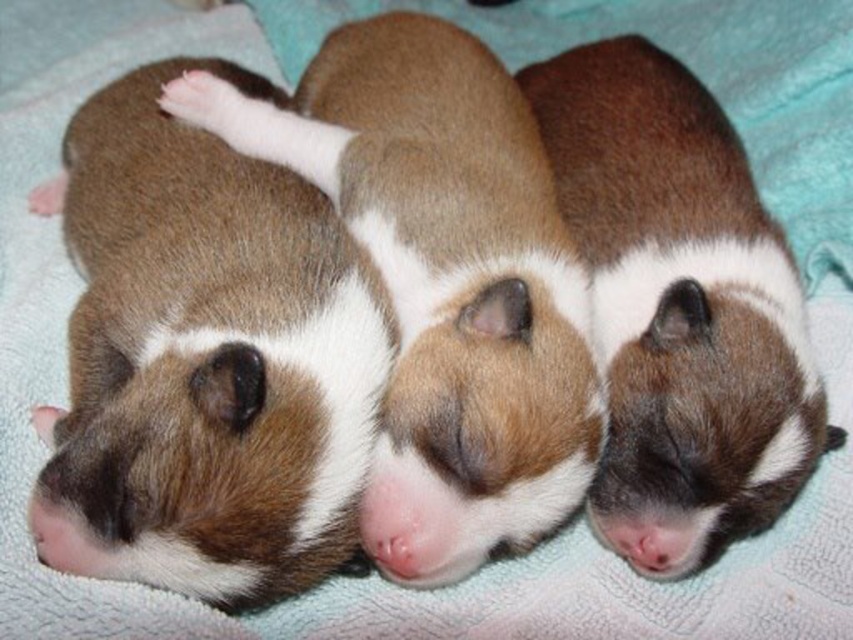
You are a pet owner who wants to place a divider between the brown fur puppy at left and the brown fuzzy guinea pig at center. If the divider is 10 cm wide, will it fit between them?

The brown fur puppy at left is wider than the brown fuzzy guinea pig at center. Therefore, a 10 cm wide divider may not fit between them since the guinea pig is narrower. Please check the actual space between them.

You are a photographer trying to capture a closeup of the brown soft fur puppy at center. The camera is currently focused at point point (444, 284). Is the camera focused on the correct puppy?

The point (444, 284) corresponds to the brown soft fur puppy at center, so yes, the camera is focused on the correct puppy.

You are a veterinarian examining the three puppies on the blanket. You need to determine which puppy is shorter between the brown fur puppy at left and the brown soft fur puppy at center. Which one is shorter?

The brown fur puppy at left is shorter than the brown soft fur puppy at center.